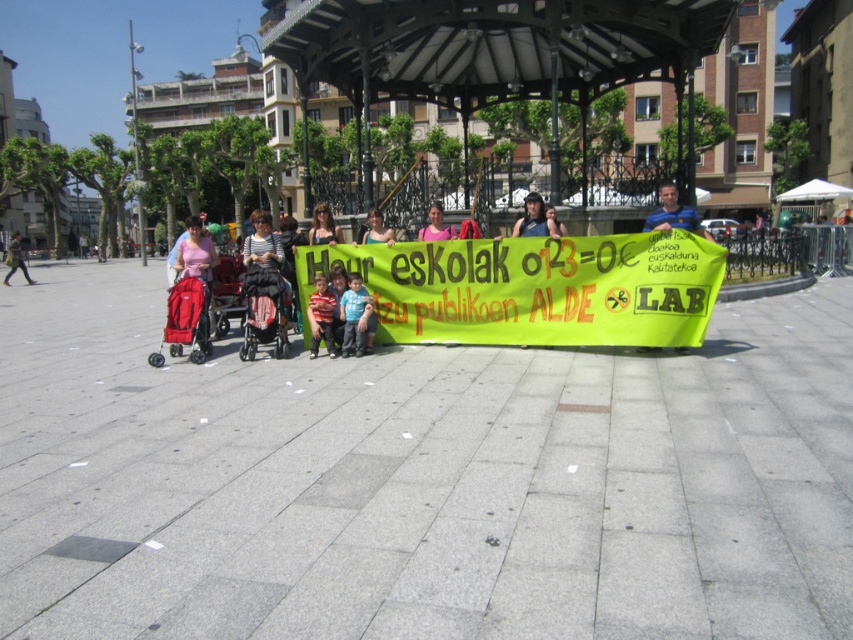
You are a photographer positioned at the town square. You want to capture a photo that includes the green fabric banner at center and ensure it is centered in the frame. Given that your camera has a fixed focal length, which object should you adjust your position relative to to achieve this composition?

The green fabric banner at center is already positioned at the center of the scene, so you should ensure your camera is aligned with the center point to capture it properly.

Looking at this image, you are a photographer trying to capture a photo of the matte black shirt at center and the matte black stroller at left. If you want to ensure both objects are in focus, which one should you focus on first?

The matte black shirt at center is shorter than the matte black stroller at left. To ensure both are in focus, you should focus on the matte black stroller at left since it is farther away, allowing the depth of field to cover both objects.